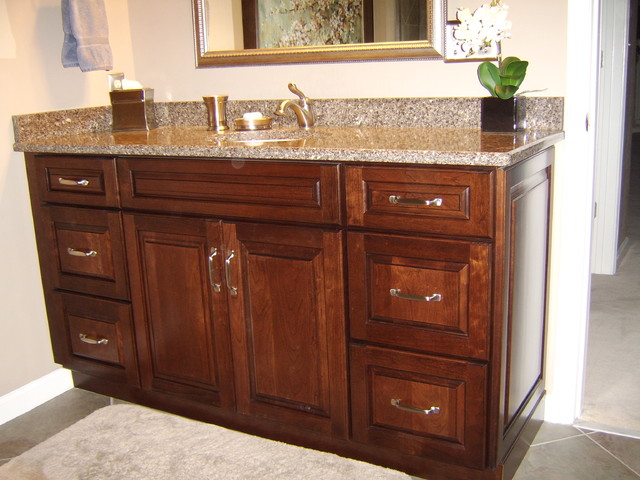
The image size is (640, 480). What are the coordinates of `drawers` in the screenshot? It's located at (420, 209), (422, 289), (416, 401), (93, 356), (97, 267), (84, 181).